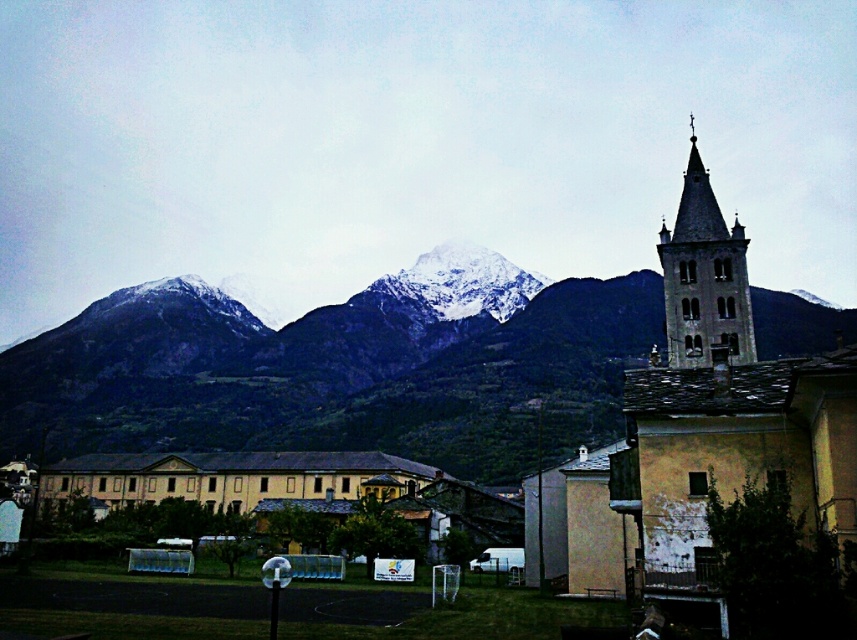
You are planning to build a new communication tower between the snowy rock mountain range at upper center and the yellow stone church at right. Since the tower needs to be visible from both the mountain and the church, should it be placed closer to the taller object or the shorter one?

The snowy rock mountain range at upper center is much taller than the yellow stone church at right. To ensure visibility from both locations, the communication tower should be placed closer to the shorter yellow stone church at right so that it can be seen above the church without being obscured by the taller mountain.

You are standing in the village and want to take a photo of the yellow stone church at right. However, the snowy rock mountain range at upper center is blocking your view. Is there a way to position yourself so that the church is visible without the mountains blocking it?

The yellow stone church at right is behind the snowy rock mountain range at upper center, so you would need to move to a position where you can see around or over the mountains to capture the church without obstruction.

You are an architect designing a new observation deck. You need to ensure it can accommodate a large window facing the snowy rock mountain range at upper center and the dark gray stone bell tower at upper right. Which object requires a wider window to fully view?

The snowy rock mountain range at upper center requires a wider window because its width is larger than the dark gray stone bell tower at upper right.